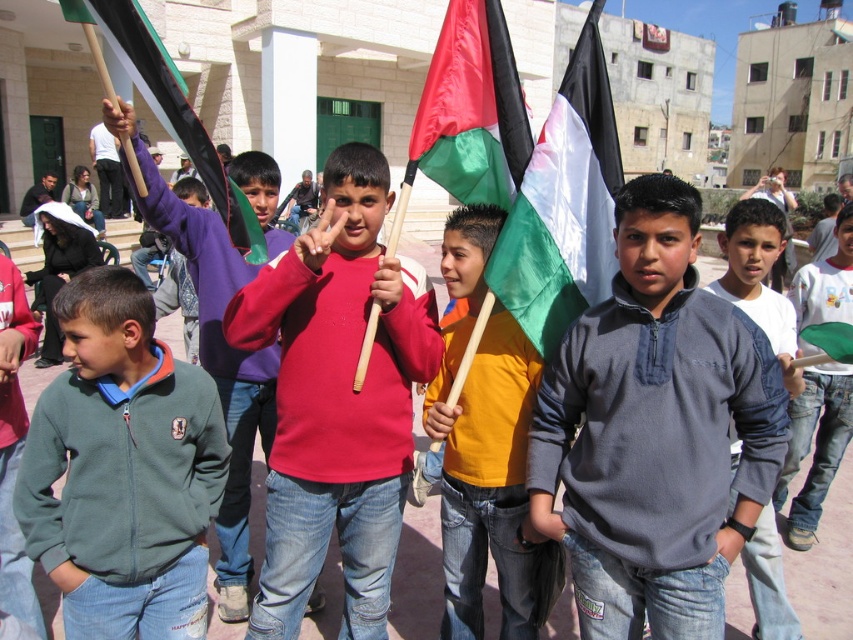
Between silky fabric flag at center and green denim jeans at center, which one appears on the left side from the viewer's perspective?

From the viewer's perspective, silky fabric flag at center appears more on the left side.

How far apart are silky fabric flag at center and green denim jeans at center?

silky fabric flag at center is 3.01 meters away from green denim jeans at center.

Does point (503, 304) come in front of point (811, 433)?

Yes, point (503, 304) is closer to viewer.

You are a GUI agent. You are given a task and a screenshot of the screen. Output one action in this format:
    pyautogui.click(x=<x>, y=<y>)
    Task: Click on the silky fabric flag at center
    
    Given the screenshot: What is the action you would take?
    pyautogui.click(x=563, y=204)

Can you confirm if gray fleece sweater at center is bigger than green fleece jacket at left?

Yes.

Between point (734, 557) and point (113, 577), which one is positioned in front?

Positioned in front is point (734, 557).

Where is `gray fleece sweater at center`? gray fleece sweater at center is located at coordinates (654, 433).

Where is `gray fleece sweater at center`? This screenshot has height=640, width=853. gray fleece sweater at center is located at coordinates (654, 433).

Identify the location of silky fabric flag at center. The width and height of the screenshot is (853, 640). (563, 204).

How distant is silky fabric flag at center from gray fleece jacket at center?

The distance of silky fabric flag at center from gray fleece jacket at center is 2.94 meters.

Is point (541, 136) behind point (784, 237)?

That is False.

I want to click on silky fabric flag at center, so click(563, 204).